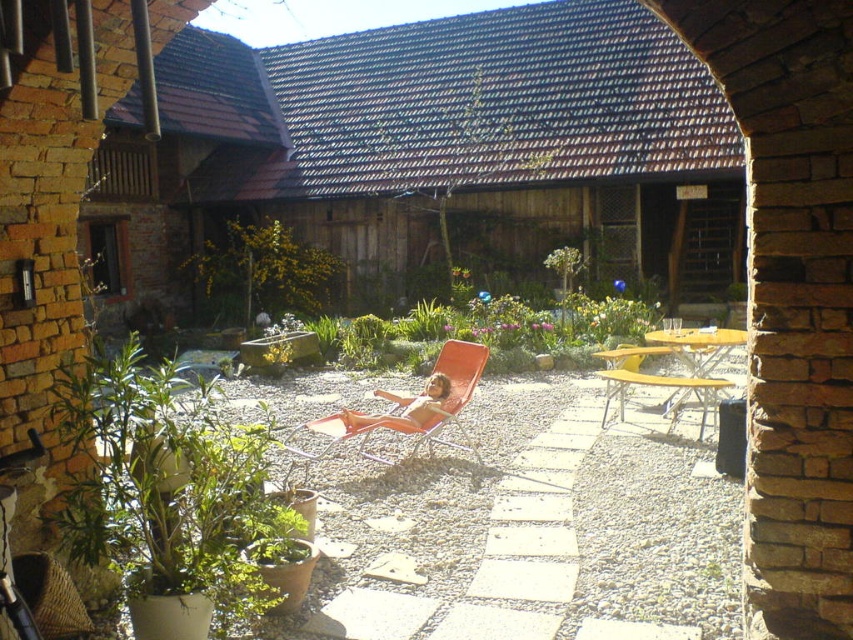
Which is more to the left, yellow-green leaves at center or yellow plastic beach chair at center?

yellow-green leaves at center is more to the left.

Is yellow-green leaves at center positioned before yellow plastic beach chair at center?

That is False.

Does point (252, 227) come closer to viewer compared to point (672, 352)?

No.

Find the location of a particular element. This screenshot has width=853, height=640. yellow-green leaves at center is located at coordinates (260, 273).

Can you confirm if green leafy plant at lower left is taller than yellow plastic beach chair at center?

Indeed, green leafy plant at lower left has a greater height compared to yellow plastic beach chair at center.

Which is below, green leafy plant at lower left or yellow plastic beach chair at center?

Positioned lower is green leafy plant at lower left.

The width and height of the screenshot is (853, 640). I want to click on green leafy plant at lower left, so click(x=170, y=497).

Based on the photo, does yellow-green leaves at center have a larger size compared to orange mesh beach chair at center?

Indeed, yellow-green leaves at center has a larger size compared to orange mesh beach chair at center.

Does yellow-green leaves at center have a greater height compared to orange mesh beach chair at center?

Indeed, yellow-green leaves at center has a greater height compared to orange mesh beach chair at center.

Is point (337, 260) positioned after point (384, 394)?

Yes, it is.

The height and width of the screenshot is (640, 853). I want to click on yellow-green leaves at center, so click(x=260, y=273).